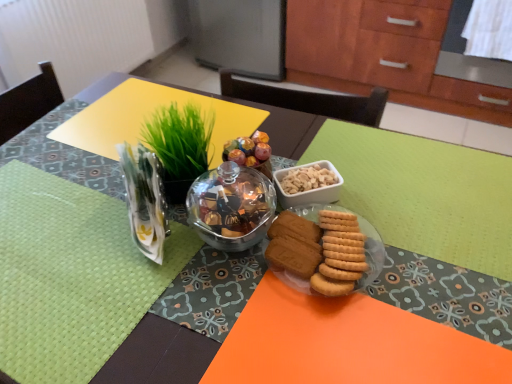
You are a GUI agent. You are given a task and a screenshot of the screen. Output one action in this format:
    pyautogui.click(x=<x>, y=<y>)
    Task: Click on the vacant area that lies to the right of matte glass plate at center
    This screenshot has width=512, height=384.
    Given the screenshot: What is the action you would take?
    pyautogui.click(x=424, y=283)